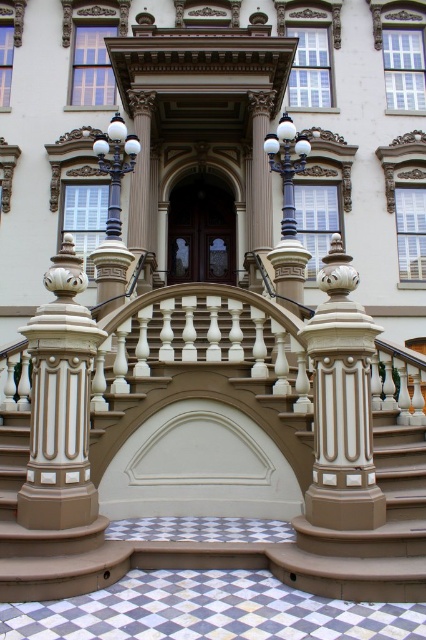
Question: Based on their relative distances, which object is farther from the matte beige column at center?

Choices:
 (A) matte beige staircase at center
 (B) brown wooden door at center

Answer: (B)

Question: Which of the following is the closest to the observer?

Choices:
 (A) (57, 310)
 (B) (313, 477)
 (C) (190, 230)

Answer: (B)

Question: Is matte beige staircase at center to the left of matte beige column at center from the viewer's perspective?

Choices:
 (A) yes
 (B) no

Answer: (A)

Question: Is matte beige staircase at center above matte beige column at center?

Choices:
 (A) yes
 (B) no

Answer: (B)

Question: Among these objects, which one is nearest to the camera?

Choices:
 (A) beige glossy column at center
 (B) matte beige column at center
 (C) matte beige staircase at center
 (D) brown wooden door at center

Answer: (B)

Question: Does matte beige staircase at center come in front of matte beige column at center?

Choices:
 (A) no
 (B) yes

Answer: (A)